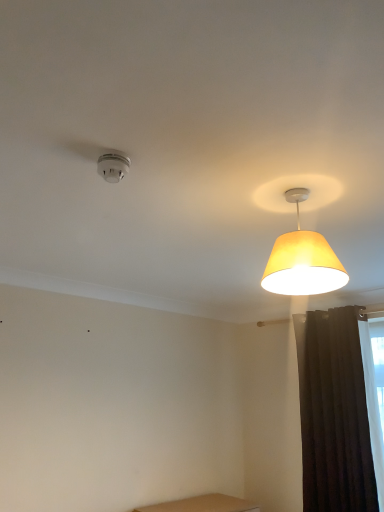
Question: Is dark matte curtain at right at the back of white plastic smoke detector at upper left, the 2th lamp viewed from the right?

Choices:
 (A) yes
 (B) no

Answer: (B)

Question: From a real-world perspective, does white plastic smoke detector at upper left, the 2th lamp viewed from the right, stand above dark matte curtain at right?

Choices:
 (A) yes
 (B) no

Answer: (A)

Question: Does white plastic smoke detector at upper left, the 2th lamp viewed from the right, come in front of dark matte curtain at right?

Choices:
 (A) yes
 (B) no

Answer: (A)

Question: From the image's perspective, would you say white plastic smoke detector at upper left, the 2th lamp viewed from the right, is shown under dark matte curtain at right?

Choices:
 (A) yes
 (B) no

Answer: (B)

Question: From a real-world perspective, is white plastic smoke detector at upper left, the 2th lamp viewed from the right, located beneath dark matte curtain at right?

Choices:
 (A) no
 (B) yes

Answer: (A)

Question: Is white plastic smoke detector at upper left, the 2th lamp viewed from the right, taller than dark matte curtain at right?

Choices:
 (A) no
 (B) yes

Answer: (A)

Question: From the image's perspective, is yellow fabric lampshade at upper right, the 1th lamp from the right, above dark matte curtain at right?

Choices:
 (A) no
 (B) yes

Answer: (B)

Question: Does yellow fabric lampshade at upper right, which appears as the 2th lamp when viewed from the left, appear on the right side of dark matte curtain at right?

Choices:
 (A) no
 (B) yes

Answer: (A)

Question: Could dark matte curtain at right be considered to be inside yellow fabric lampshade at upper right, which appears as the 2th lamp when viewed from the left?

Choices:
 (A) no
 (B) yes

Answer: (A)

Question: Does yellow fabric lampshade at upper right, the 1th lamp from the right, have a lesser width compared to dark matte curtain at right?

Choices:
 (A) no
 (B) yes

Answer: (A)

Question: Is yellow fabric lampshade at upper right, the 1th lamp from the right, aimed at dark matte curtain at right?

Choices:
 (A) no
 (B) yes

Answer: (A)

Question: Does yellow fabric lampshade at upper right, which appears as the 2th lamp when viewed from the left, lie in front of dark matte curtain at right?

Choices:
 (A) yes
 (B) no

Answer: (A)

Question: Are dark matte curtain at right and yellow fabric lampshade at upper right, the 1th lamp from the right, far apart?

Choices:
 (A) yes
 (B) no

Answer: (A)